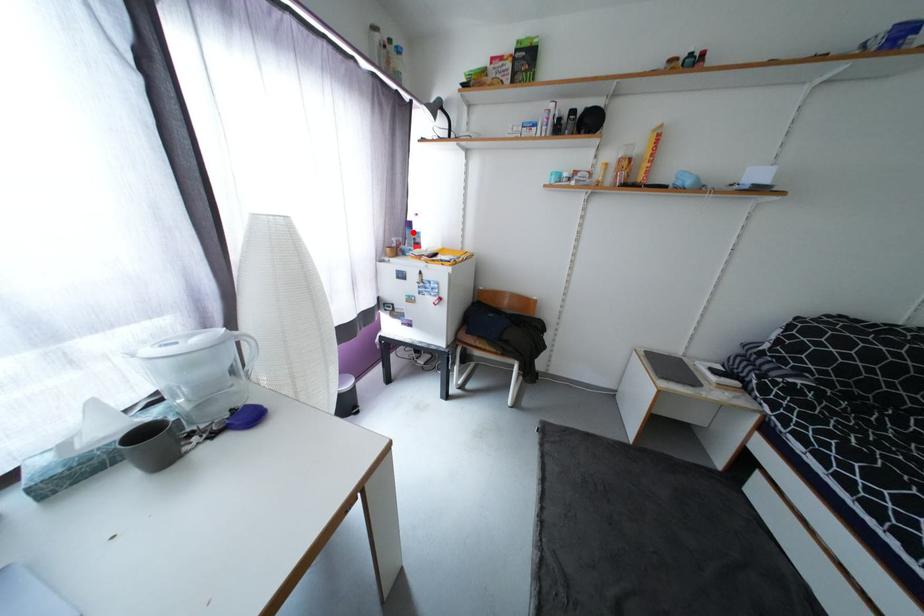
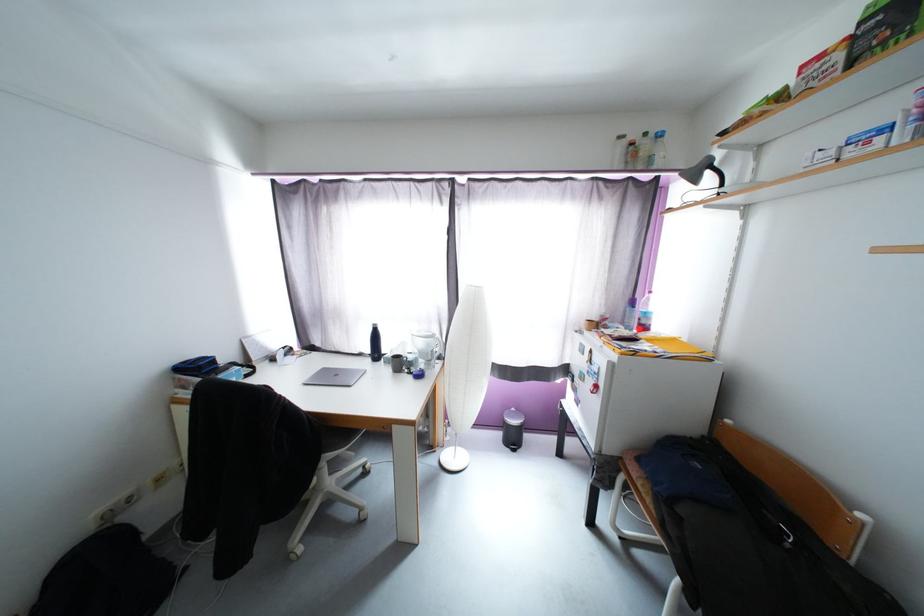
The point at the highlighted location is marked in the first image. Where is the corresponding point in the second image?

(634, 310)